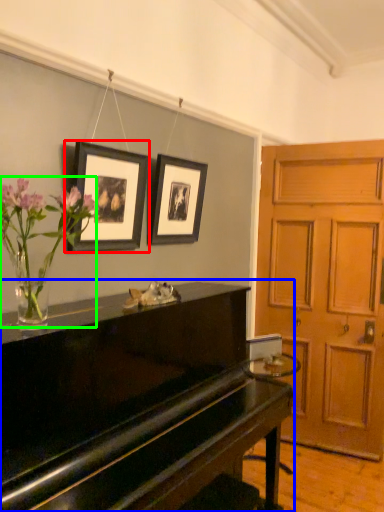
Question: Estimate the real-world distances between objects in this image. Which object is farther from picture frame (highlighted by a red box), piano (highlighted by a blue box) or floral arrangement (highlighted by a green box)?

Choices:
 (A) piano
 (B) floral arrangement

Answer: (A)